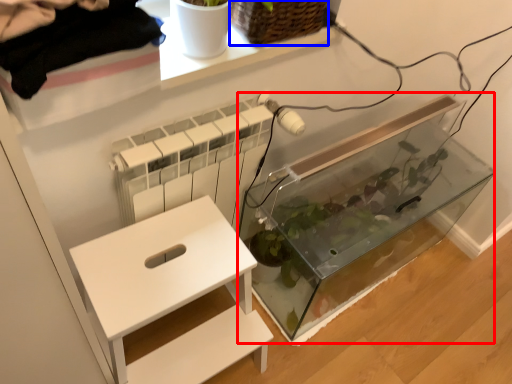
Question: Which point is further to the camera, glass box (highlighted by a red box) or basket (highlighted by a blue box)?

Choices:
 (A) glass box
 (B) basket

Answer: (A)